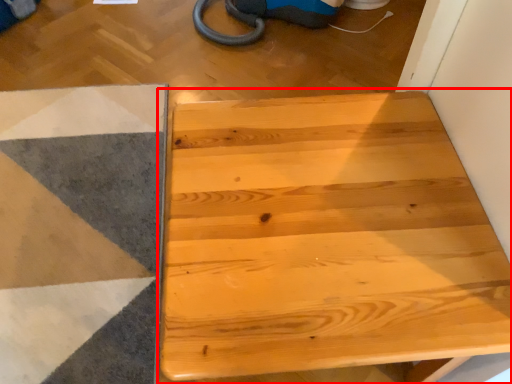
Question: Observing the image, what is the correct spatial positioning of table (annotated by the red box) in reference to ramp?

Choices:
 (A) right
 (B) left

Answer: (A)